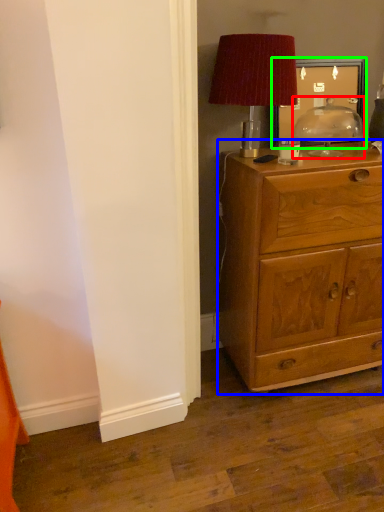
Question: Based on their relative distances, which object is nearer to table lamp (highlighted by a red box)? Choose from chest of drawers (highlighted by a blue box) and picture frame (highlighted by a green box).

Choices:
 (A) chest of drawers
 (B) picture frame

Answer: (B)